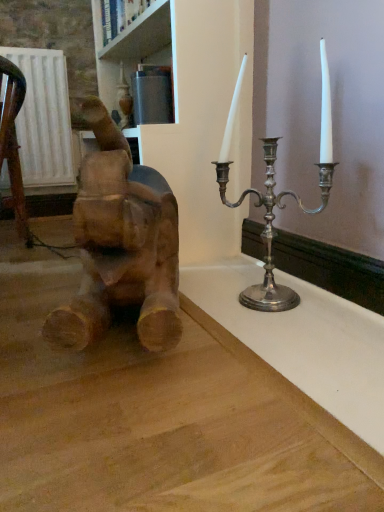
Find the location of a particular element. This screenshot has width=384, height=512. free location in front of wooden elephant at left is located at coordinates (158, 422).